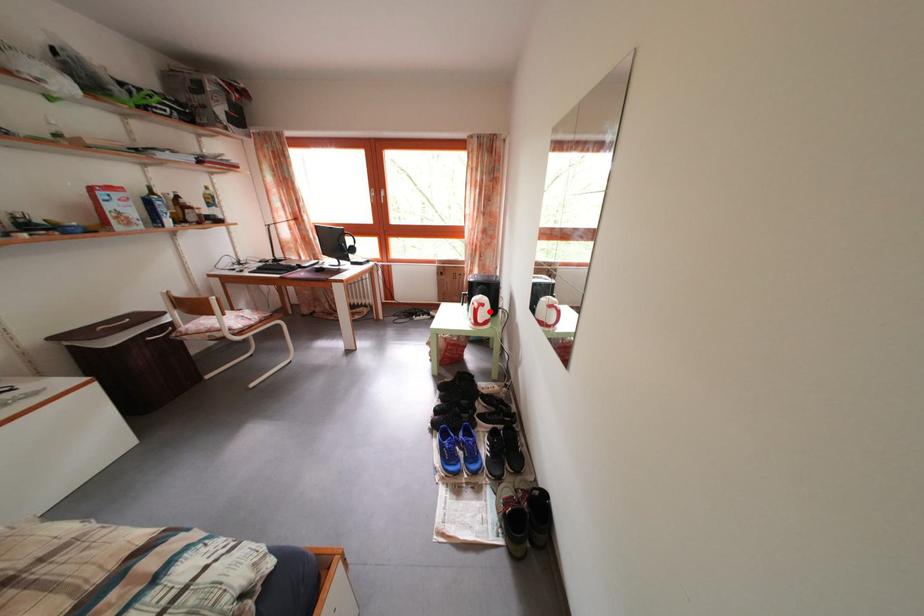
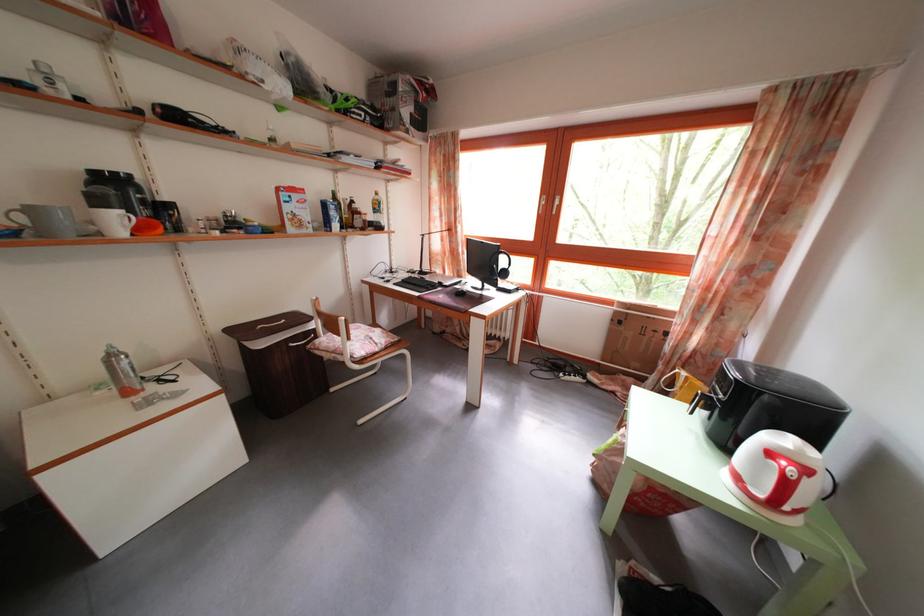
Find the pixel in the second image that matches the highlighted location in the first image.

(812, 477)